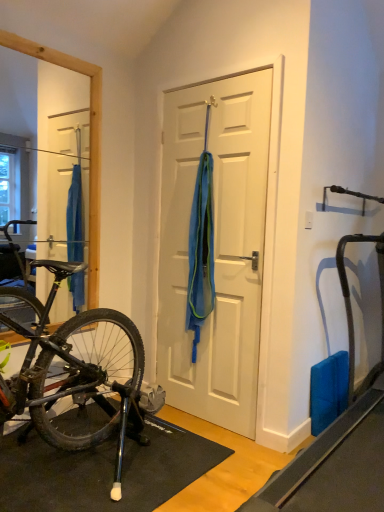
Question: Does white matte door at center come behind blue rubber mat at right?

Choices:
 (A) yes
 (B) no

Answer: (A)

Question: Is blue rubber mat at right located within white matte door at center?

Choices:
 (A) yes
 (B) no

Answer: (B)

Question: Considering the relative sizes of white matte door at center and blue rubber mat at right in the image provided, is white matte door at center wider than blue rubber mat at right?

Choices:
 (A) yes
 (B) no

Answer: (B)

Question: From the image's perspective, does white matte door at center appear lower than blue rubber mat at right?

Choices:
 (A) no
 (B) yes

Answer: (A)

Question: Is white matte door at center shorter than blue rubber mat at right?

Choices:
 (A) yes
 (B) no

Answer: (B)

Question: Does point click(x=206, y=175) appear closer or farther from the camera than point click(x=208, y=365)?

Choices:
 (A) farther
 (B) closer

Answer: (B)

Question: Looking at their shapes, would you say blue mesh towel at center is wider or thinner than white matte door at center?

Choices:
 (A) wide
 (B) thin

Answer: (A)

Question: From their relative heights in the image, would you say blue mesh towel at center is taller or shorter than white matte door at center?

Choices:
 (A) short
 (B) tall

Answer: (A)

Question: In the image, is blue mesh towel at center positioned in front of or behind white matte door at center?

Choices:
 (A) front
 (B) behind

Answer: (B)

Question: Is white matte door at center in front of or behind blue mesh towel at center in the image?

Choices:
 (A) front
 (B) behind

Answer: (A)

Question: From the image's perspective, relative to blue mesh towel at center, is white matte door at center above or below?

Choices:
 (A) below
 (B) above

Answer: (A)

Question: Which is correct: white matte door at center is inside blue mesh towel at center, or outside of it?

Choices:
 (A) outside
 (B) inside

Answer: (A)

Question: From a real-world perspective, is white matte door at center physically located above or below blue mesh towel at center?

Choices:
 (A) below
 (B) above

Answer: (A)

Question: Considering their positions, is white matte door at center located in front of or behind blue rubber mat at right?

Choices:
 (A) front
 (B) behind

Answer: (B)

Question: Is point (244, 161) positioned closer to the camera than point (337, 252)?

Choices:
 (A) farther
 (B) closer

Answer: (B)